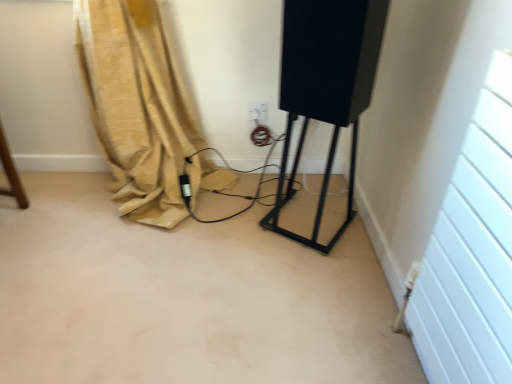
Describe the element at coordinates (258, 111) in the screenshot. This screenshot has width=512, height=384. I see `white plastic electric outlet at center` at that location.

What is the approximate width of black matte speaker at center?

black matte speaker at center is 12.86 inches wide.

Image resolution: width=512 pixels, height=384 pixels. In order to click on white plastic electric outlet at center in this screenshot , I will do `click(258, 111)`.

Looking at this image, is white plastic electric outlet at center looking in the opposite direction of black matte speaker at center?

No.

This screenshot has height=384, width=512. Identify the location of electric outlet on the left side of black matte speaker at center. (258, 111).

Can you confirm if white plastic electric outlet at center is positioned to the left of black matte speaker at center?

Yes.

How different are the orientations of white plastic electric outlet at center and black matte speaker at center in degrees?

white plastic electric outlet at center and black matte speaker at center are facing 31.7 degrees away from each other.

Looking at this image, is black matte speaker at center far away from white plastic electric outlet at center?

No, there isn't a large distance between black matte speaker at center and white plastic electric outlet at center.

Is black matte speaker at center positioned beyond the bounds of white plastic electric outlet at center?

Yes, black matte speaker at center is not within white plastic electric outlet at center.

Does point (355, 64) come farther from viewer compared to point (257, 114)?

No, (355, 64) is in front of (257, 114).

From a real-world perspective, is black matte speaker at center located higher than white plastic electric outlet at center?

Correct, in the physical world, black matte speaker at center is higher than white plastic electric outlet at center.

From the image's perspective, which one is positioned higher, white plastic electric outlet at center or beige fabric curtain at lower left?

white plastic electric outlet at center.

In the scene shown: How far apart are white plastic electric outlet at center and beige fabric curtain at lower left?

A distance of 20.31 inches exists between white plastic electric outlet at center and beige fabric curtain at lower left.

Which object is wider, white plastic electric outlet at center or beige fabric curtain at lower left?

beige fabric curtain at lower left is wider.

Is beige fabric curtain at lower left at the back of white plastic electric outlet at center?

white plastic electric outlet at center is not turned away from beige fabric curtain at lower left.

Is point (113, 0) positioned after point (346, 37)?

Yes, it is.

I want to click on curtain lying above the black matte speaker at center (from the image's perspective), so click(x=137, y=106).

From the picture: Considering the sizes of objects beige fabric curtain at lower left and black matte speaker at center in the image provided, who is taller, beige fabric curtain at lower left or black matte speaker at center?

With more height is black matte speaker at center.

Is the depth of black matte speaker at center less than that of beige fabric curtain at lower left?

Yes, black matte speaker at center is closer to the camera.

From the image's perspective, who appears lower, black matte speaker at center or beige fabric curtain at lower left?

black matte speaker at center, from the image's perspective.

Is black matte speaker at center located outside beige fabric curtain at lower left?

black matte speaker at center lies outside beige fabric curtain at lower left's area.

From a real-world perspective, is black matte speaker at center positioned under beige fabric curtain at lower left based on gravity?

No, from a real-world perspective, black matte speaker at center is not below beige fabric curtain at lower left.

Does beige fabric curtain at lower left turn towards white plastic electric outlet at center?

No, beige fabric curtain at lower left is not turned towards white plastic electric outlet at center.

Would you say white plastic electric outlet at center is part of beige fabric curtain at lower left's contents?

No, white plastic electric outlet at center is located outside of beige fabric curtain at lower left.

Which of these two, beige fabric curtain at lower left or white plastic electric outlet at center, is thinner?

Thinner between the two is white plastic electric outlet at center.

How different are the orientations of beige fabric curtain at lower left and white plastic electric outlet at center in degrees?

0.612 degrees.

Locate an element on the screen. electric outlet that appears behind the black matte speaker at center is located at coordinates (258, 111).

Image resolution: width=512 pixels, height=384 pixels. What are the coordinates of `equipment above the white plastic electric outlet at center (from a real-world perspective)` in the screenshot? It's located at (326, 86).

Based on their spatial positions, is white plastic electric outlet at center or beige fabric curtain at lower left further from black matte speaker at center?

Based on the image, beige fabric curtain at lower left appears to be further to black matte speaker at center.

Which object lies nearer to the anchor point white plastic electric outlet at center, black matte speaker at center or beige fabric curtain at lower left?

black matte speaker at center is positioned closer to the anchor white plastic electric outlet at center.

Considering their positions, is beige fabric curtain at lower left positioned further to black matte speaker at center than white plastic electric outlet at center?

The object further to black matte speaker at center is beige fabric curtain at lower left.

Which object lies nearer to the anchor point white plastic electric outlet at center, beige fabric curtain at lower left or black matte speaker at center?

The object closer to white plastic electric outlet at center is black matte speaker at center.

Estimate the real-world distances between objects in this image. Which object is further from beige fabric curtain at lower left, black matte speaker at center or white plastic electric outlet at center?

Based on the image, black matte speaker at center appears to be further to beige fabric curtain at lower left.

Estimate the real-world distances between objects in this image. Which object is closer to beige fabric curtain at lower left, white plastic electric outlet at center or black matte speaker at center?

white plastic electric outlet at center.

Identify the location of curtain between black matte speaker at center and white plastic electric outlet at center in the front-back direction. (137, 106).